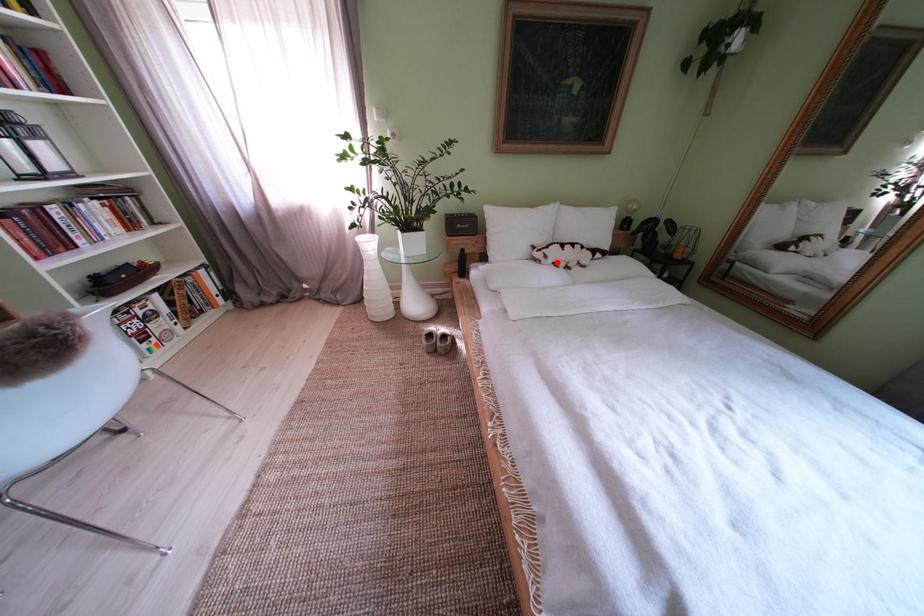
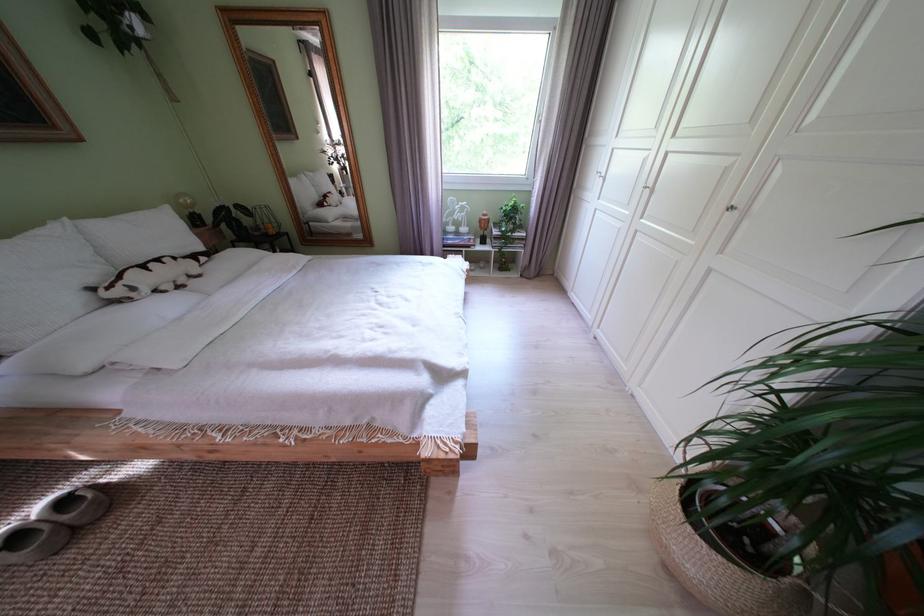
Question: I am providing you with two images of the same scene from different viewpoints. A red point is shown in image1. For the corresponding object point in image2, is it positioned nearer or farther from the camera?

Choices:
 (A) Nearer
 (B) Farther

Answer: (B)